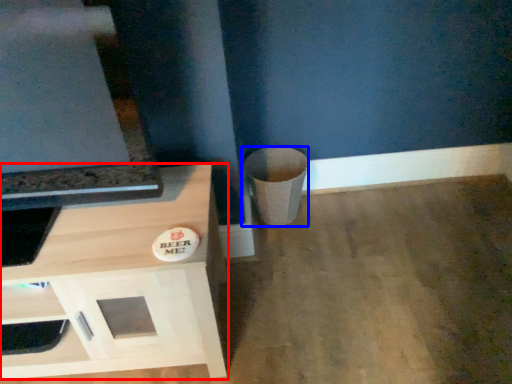
Question: Among these objects, which one is farthest to the camera, cabinetry (highlighted by a red box) or trash bin/can (highlighted by a blue box)?

Choices:
 (A) cabinetry
 (B) trash bin/can

Answer: (B)